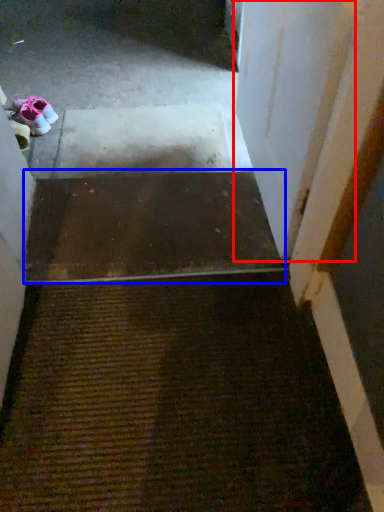
Question: Among these objects, which one is nearest to the camera, door (highlighted by a red box) or stairs (highlighted by a blue box)?

Choices:
 (A) door
 (B) stairs

Answer: (A)